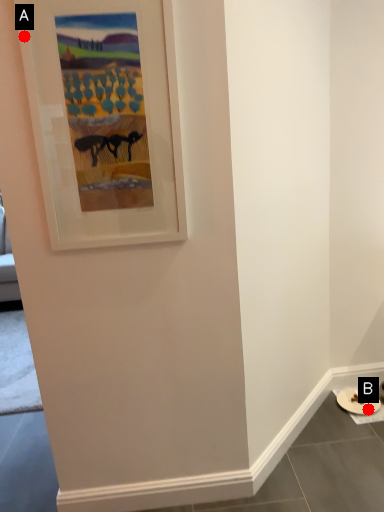
Question: Two points are circled on the image, labeled by A and B beside each circle. Which point is closer to the camera?

Choices:
 (A) A is closer
 (B) B is closer

Answer: (A)